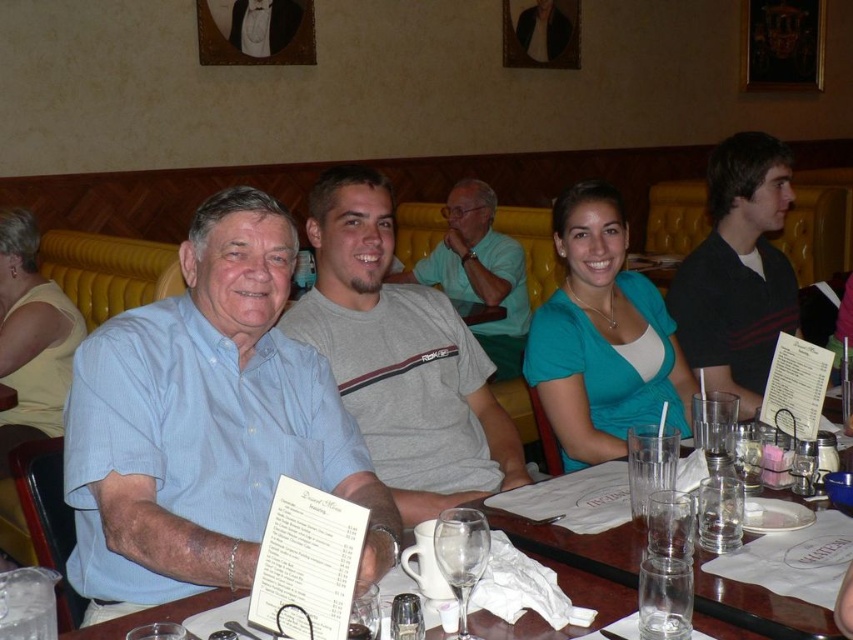
You are a photographer adjusting the camera focus. You need to ensure both the light blue shirt at left and the clear glassware at center are in focus. Which object should you focus on first to achieve proper depth of field?

The light blue shirt at left should be focused on first because it is larger in size compared to the clear glassware at center, allowing the depth of field to cover both objects effectively.